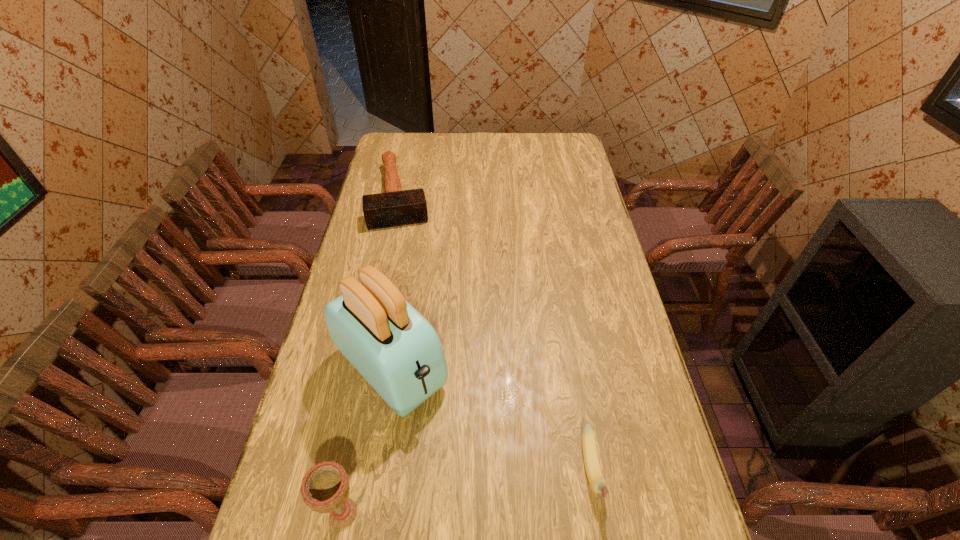
Find the location of a particular element. The width and height of the screenshot is (960, 540). chalice is located at coordinates (325, 488).

Where is `banana`? banana is located at coordinates (597, 482).

The height and width of the screenshot is (540, 960). Find the location of `the tallest object`. the tallest object is located at coordinates (397, 351).

What are the coordinates of `toaster` in the screenshot? It's located at (397, 351).

Identify the location of mallet. (395, 207).

In order to click on free spot located on the right of the third shortest object in this screenshot , I will do `click(502, 514)`.

Identify the location of vacant area situated on the side of the second farthest object with the lever. (500, 481).

The height and width of the screenshot is (540, 960). What are the coordinates of `vacant space positioned 0.140m on the side of the second farthest object with the lever` in the screenshot? It's located at (465, 445).

Where is `vacant point located 0.360m on the side of the second farthest object with the lever`? The height and width of the screenshot is (540, 960). vacant point located 0.360m on the side of the second farthest object with the lever is located at coordinates tap(532, 514).

Locate an element on the screen. vacant position located on the striking face of the mallet is located at coordinates (410, 287).